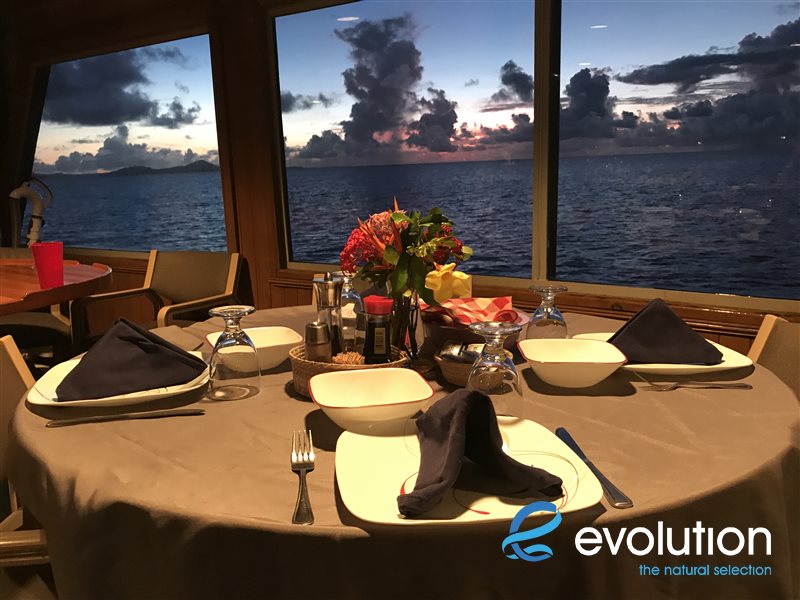
Locate an element on the screen. The image size is (800, 600). checkerboard cloth is located at coordinates (458, 309).